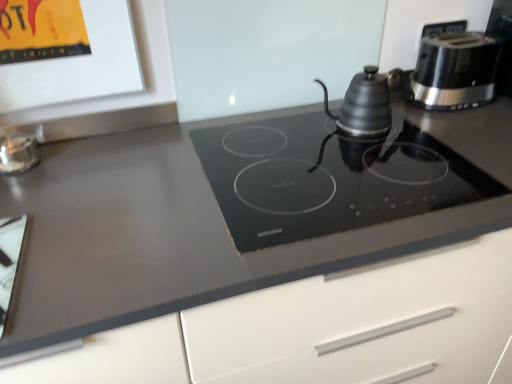
Question: Is black plastic toaster at upper right, acting as the first kitchen appliance starting from the right, at the back of matte black kettle at upper right, the first kitchen appliance viewed from the left?

Choices:
 (A) yes
 (B) no

Answer: (B)

Question: From a real-world perspective, is matte black kettle at upper right, the first kitchen appliance viewed from the left, on top of black plastic toaster at upper right, acting as the first kitchen appliance starting from the right?

Choices:
 (A) yes
 (B) no

Answer: (B)

Question: Is matte black kettle at upper right, the 2th kitchen appliance positioned from the right, placed right next to black plastic toaster at upper right, acting as the first kitchen appliance starting from the right?

Choices:
 (A) no
 (B) yes

Answer: (A)

Question: Is the depth of matte black kettle at upper right, the first kitchen appliance viewed from the left, greater than that of black plastic toaster at upper right, arranged as the second kitchen appliance when viewed from the left?

Choices:
 (A) no
 (B) yes

Answer: (A)

Question: Is matte black kettle at upper right, the 2th kitchen appliance positioned from the right, not close to black plastic toaster at upper right, acting as the first kitchen appliance starting from the right?

Choices:
 (A) yes
 (B) no

Answer: (B)

Question: Could you tell me if matte black kettle at upper right, the first kitchen appliance viewed from the left, is turned towards black plastic toaster at upper right, acting as the first kitchen appliance starting from the right?

Choices:
 (A) no
 (B) yes

Answer: (A)

Question: Considering the relative sizes of clear glass jar at left, the 1th appliance positioned from the back, and black glass cooktop at center in the image provided, is clear glass jar at left, the 1th appliance positioned from the back, smaller than black glass cooktop at center?

Choices:
 (A) no
 (B) yes

Answer: (B)

Question: Is clear glass jar at left, the 2th appliance from the bottom, not close to black glass cooktop at center?

Choices:
 (A) no
 (B) yes

Answer: (A)

Question: Is clear glass jar at left, which is the second appliance in front-to-back order, taller than black glass cooktop at center?

Choices:
 (A) yes
 (B) no

Answer: (B)

Question: Is black glass cooktop at center surrounded by clear glass jar at left, placed as the 1th appliance when sorted from top to bottom?

Choices:
 (A) yes
 (B) no

Answer: (B)

Question: Is clear glass jar at left, the 1th appliance positioned from the back, not within black glass cooktop at center?

Choices:
 (A) no
 (B) yes

Answer: (B)

Question: Is clear glass jar at left, placed as the 1th appliance when sorted from top to bottom, at the left side of black glass cooktop at center?

Choices:
 (A) yes
 (B) no

Answer: (A)

Question: Can you confirm if white glossy cutting board at lower left, which is counted as the 1th appliance, starting from the front, is shorter than clear glass jar at left, the 2th appliance from the bottom?

Choices:
 (A) no
 (B) yes

Answer: (B)